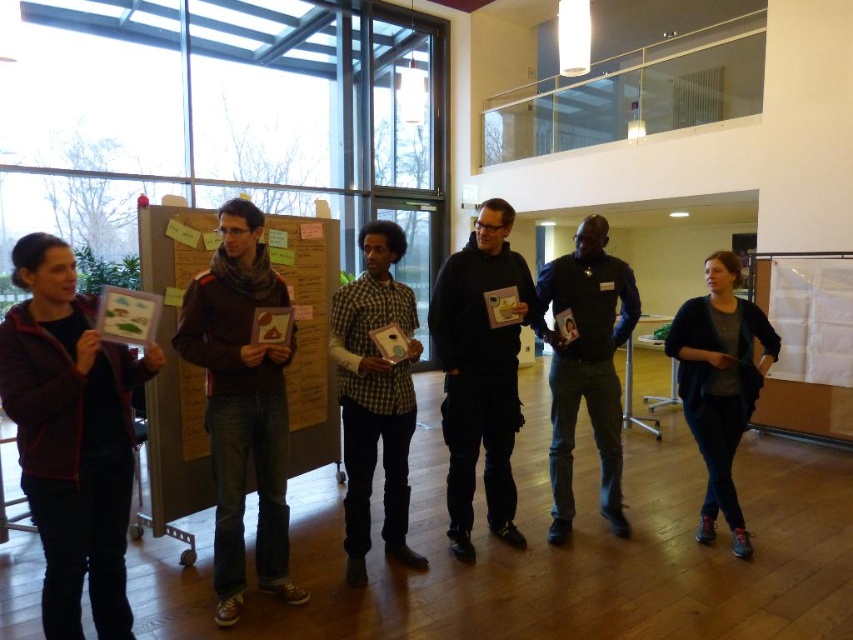
Question: Which point is farther to the camera?

Choices:
 (A) (398, 339)
 (B) (512, 289)

Answer: (B)

Question: Based on their relative distances, which object is nearer to the matte cardboard poster at left?

Choices:
 (A) matte cardboard poster at center
 (B) wooden noticeboard at left

Answer: (A)

Question: Considering the real-world distances, which object is closest to the checkered fabric shirt at center?

Choices:
 (A) black matte hoodie at center
 (B) black matte jacket at center
 (C) dark brown leather jacket at left

Answer: (A)

Question: Does checkered fabric shirt at center have a smaller size compared to black matte jacket at center?

Choices:
 (A) yes
 (B) no

Answer: (A)

Question: Does wooden noticeboard at left have a greater width compared to checkered fabric shirt at center?

Choices:
 (A) yes
 (B) no

Answer: (B)

Question: Observing the image, what is the correct spatial positioning of dark brown leather jacket at left in reference to wooden noticeboard at left?

Choices:
 (A) below
 (B) above

Answer: (A)